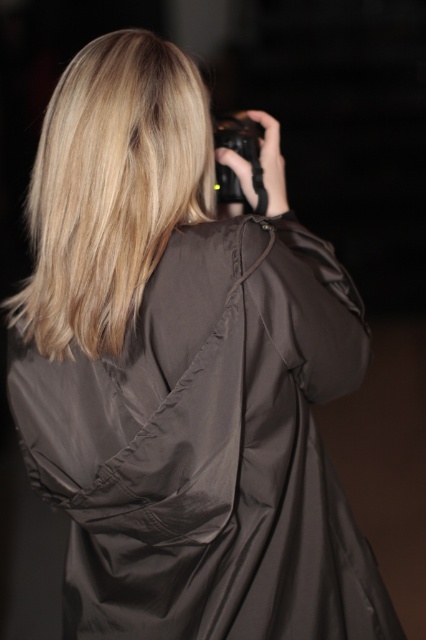
Is blonde silky hair at upper center bigger than black rubber camera at upper center?

Indeed, blonde silky hair at upper center has a larger size compared to black rubber camera at upper center.

Measure the distance between blonde silky hair at upper center and camera.

They are 3.51 feet apart.

Does point (198, 80) lie behind point (253, 124)?

No, it is in front of (253, 124).

Find the location of `blonde silky hair at upper center`. blonde silky hair at upper center is located at coordinates (112, 188).

Can you confirm if matte black dress at center is positioned to the right of black rubber camera at upper center?

No, matte black dress at center is not to the right of black rubber camera at upper center.

Who is more forward, (344, 330) or (227, 129)?

Point (344, 330)

At what (x,y) coordinates should I click in order to perform the action: click on matte black dress at center. Please return your answer as a coordinate pair (x, y). Looking at the image, I should click on (210, 449).

Can you confirm if matte black dress at center is positioned to the left of blonde silky hair at upper center?

Incorrect, matte black dress at center is not on the left side of blonde silky hair at upper center.

Locate an element on the screen. The height and width of the screenshot is (640, 426). matte black dress at center is located at coordinates (210, 449).